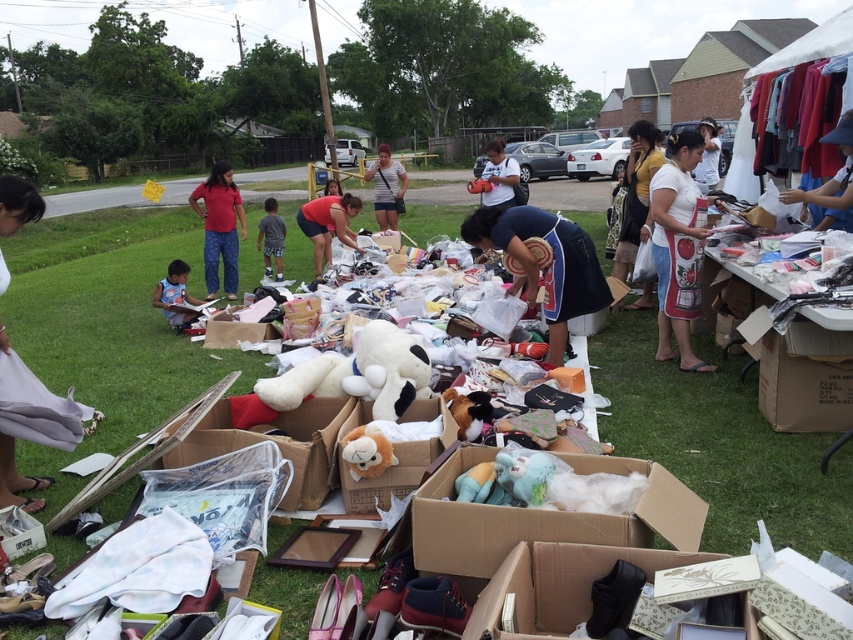
You are standing at the entrance of the flea market and see both the white fluffy stuffed toys at center and the white plush dog at center. Which one is nearer to you?

The white fluffy stuffed toys at center are closer to the viewer than the white plush dog at center.

You are a customer at the flea market and want to know which item is taller between the matte black shoe at lower center and the white cotton shirt at lower left. Can you tell me?

The white cotton shirt at lower left is taller than the matte black shoe at lower center according to the description.

You are a customer at the flea market and want to pick up both the matte black shoe at lower center and the white cotton shirt at lower left. If you can carry both items in one trip, what is the minimum distance you need to walk between them?

The minimum distance you need to walk between the matte black shoe at lower center and the white cotton shirt at lower left is 2.71 meters.